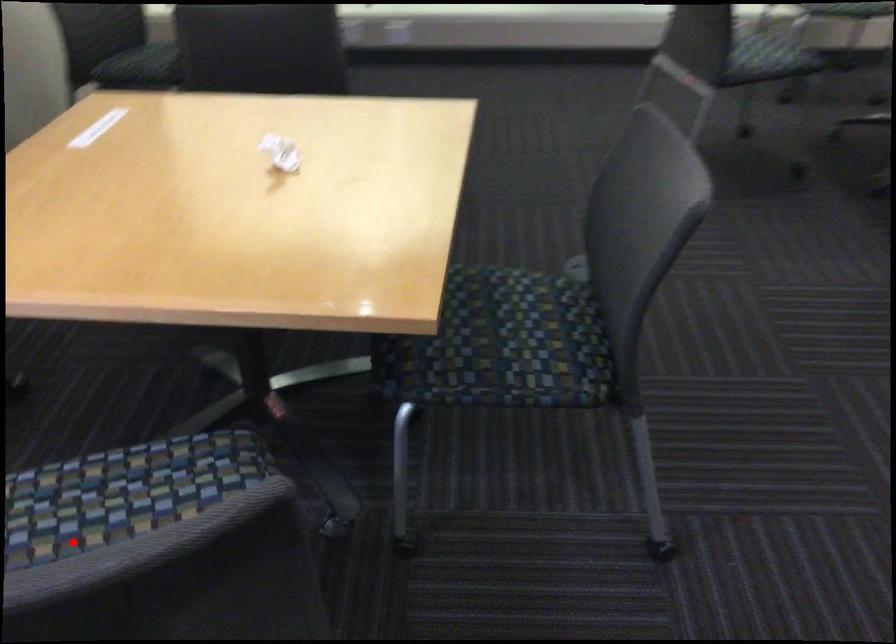
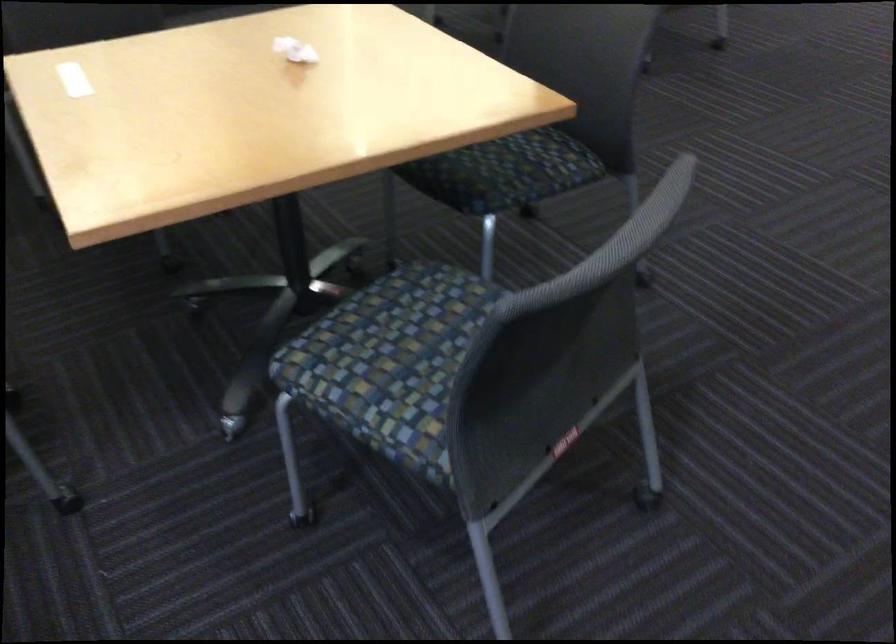
In the second image, find the point that corresponds to the highlighted location in the first image.

(391, 361)